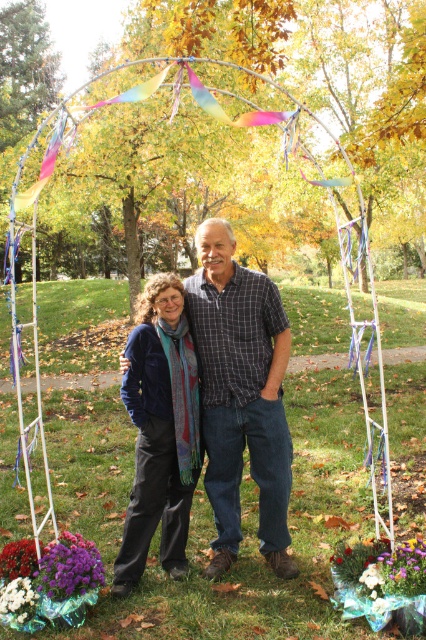
Question: In this image, where is dark blue jeans at center located relative to white fluffy flowers at lower left?

Choices:
 (A) left
 (B) right

Answer: (B)

Question: Considering the real-world distances, which object is closest to the dark blue jeans at center?

Choices:
 (A) purple fabric flowers at lower left
 (B) velvet blue scarf at center
 (C) purple matte flower at lower left

Answer: (B)

Question: Which of the following is the closest to the observer?

Choices:
 (A) velvet blue scarf at center
 (B) dark blue jeans at center
 (C) purple fabric flowers at lower left

Answer: (C)

Question: Does dark blue jeans at center have a lesser width compared to purple matte flower at lower left?

Choices:
 (A) no
 (B) yes

Answer: (A)

Question: Is white fluffy flowers at lower left wider than purple fabric flowers at lower left?

Choices:
 (A) yes
 (B) no

Answer: (B)

Question: Considering the real-world distances, which object is farthest from the dark blue jeans at center?

Choices:
 (A) velvet blue scarf at center
 (B) white fluffy flowers at lower left
 (C) purple matte flower at lower left

Answer: (B)